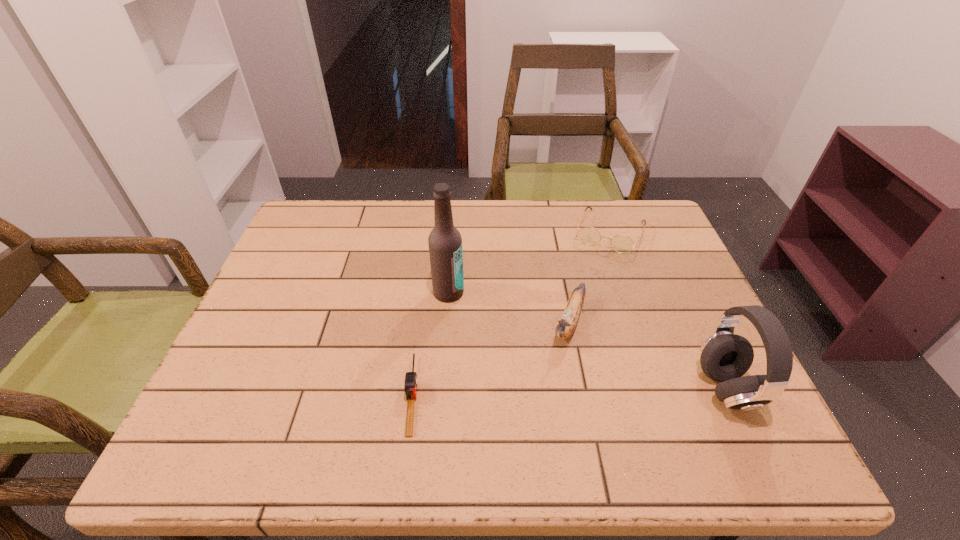
The height and width of the screenshot is (540, 960). I want to click on free space located on the side of the beer bottle with the label, so click(527, 374).

This screenshot has height=540, width=960. In order to click on vacant space located 0.330m on the side of the beer bottle with the label in this screenshot , I will do `click(545, 393)`.

Locate an element on the screen. vacant space positioned 0.290m on the side of the beer bottle with the label is located at coordinates (533, 380).

Locate an element on the screen. The height and width of the screenshot is (540, 960). blank space located 0.390m on the lenses of the fourth tallest object is located at coordinates (563, 355).

Identify the location of vacant area located on the lenses of the fourth tallest object. This screenshot has height=540, width=960. (570, 336).

Find the location of `vacant area situated 0.230m on the lenses of the fourth tallest object`. vacant area situated 0.230m on the lenses of the fourth tallest object is located at coordinates (581, 308).

This screenshot has height=540, width=960. What are the coordinates of `vacant region located on the peel of the third object from left to right` in the screenshot? It's located at (542, 395).

Where is `vacant area situated 0.130m on the peel of the third object from left to right`? The height and width of the screenshot is (540, 960). vacant area situated 0.130m on the peel of the third object from left to right is located at coordinates (544, 392).

I want to click on vacant space positioned on the peel of the third object from left to right, so click(x=552, y=374).

I want to click on object located in the far edge section of the desktop, so click(x=589, y=235).